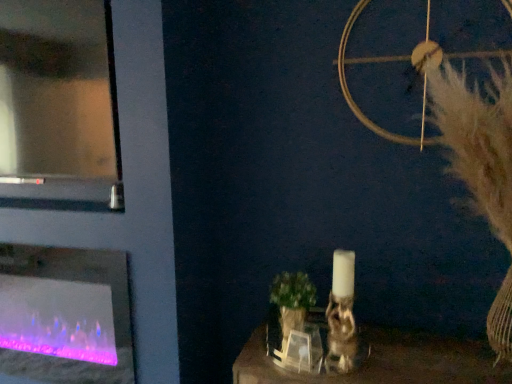
Identify the location of translucent glass fireplace at left. This screenshot has width=512, height=384. pyautogui.click(x=64, y=316).

Consider the image. Which object is closer to the camera, transparent glass door at upper left or translucent glass fireplace at left?

transparent glass door at upper left is in front.

Looking at this image, does transparent glass door at upper left appear on the left side of translucent glass fireplace at left?

Yes, transparent glass door at upper left is to the left of translucent glass fireplace at left.

Is transparent glass door at upper left taller or shorter than translucent glass fireplace at left?

In the image, transparent glass door at upper left appears to be taller than translucent glass fireplace at left.

Which of these two, white fluffy feather at upper right or transparent glass door at upper left, is bigger?

white fluffy feather at upper right is bigger.

Based on their positions, is white fluffy feather at upper right located to the left or right of transparent glass door at upper left?

From the image, it's evident that white fluffy feather at upper right is to the right of transparent glass door at upper left.

Could you tell me if white fluffy feather at upper right is turned towards transparent glass door at upper left?

No, white fluffy feather at upper right is not oriented towards transparent glass door at upper left.

Who is smaller, translucent glass fireplace at left or white fluffy feather at upper right?

Smaller between the two is translucent glass fireplace at left.

Does point (118, 342) lie in front of point (508, 146)?

That is False.

From the image's perspective, would you say translucent glass fireplace at left is positioned over white fluffy feather at upper right?

Incorrect, from the image's perspective, translucent glass fireplace at left is lower than white fluffy feather at upper right.

In the scene shown: From a real-world perspective, is translucent glass fireplace at left above or below white fluffy feather at upper right?

translucent glass fireplace at left is below white fluffy feather at upper right.

Locate an element on the screen. The image size is (512, 384). glass door on the left of white fluffy feather at upper right is located at coordinates (58, 107).

Between transparent glass door at upper left and white fluffy feather at upper right, which one has smaller width?

transparent glass door at upper left.

Is transparent glass door at upper left at the right side of white fluffy feather at upper right?

Incorrect, transparent glass door at upper left is not on the right side of white fluffy feather at upper right.

Could you tell me if transparent glass door at upper left is turned towards white fluffy feather at upper right?

No, transparent glass door at upper left is not facing towards white fluffy feather at upper right.

Considering their positions, is translucent glass fireplace at left located in front of or behind transparent glass door at upper left?

translucent glass fireplace at left is positioned farther from the viewer than transparent glass door at upper left.

From the picture: From a real-world perspective, between translucent glass fireplace at left and transparent glass door at upper left, who is vertically higher?

transparent glass door at upper left is physically above.

Is point (78, 281) farther from camera compared to point (3, 25)?

Yes.

From a real-world perspective, which is physically above, white fluffy feather at upper right or translucent glass fireplace at left?

white fluffy feather at upper right, from a real-world perspective.

Does white fluffy feather at upper right appear on the right side of translucent glass fireplace at left?

Indeed, white fluffy feather at upper right is positioned on the right side of translucent glass fireplace at left.

Considering the positions of objects white fluffy feather at upper right and translucent glass fireplace at left in the image provided, who is in front, white fluffy feather at upper right or translucent glass fireplace at left?

Positioned in front is white fluffy feather at upper right.

Is there a large distance between white fluffy feather at upper right and translucent glass fireplace at left?

Absolutely, white fluffy feather at upper right is distant from translucent glass fireplace at left.

Where is `fireplace that appears behind the transparent glass door at upper left`? Image resolution: width=512 pixels, height=384 pixels. fireplace that appears behind the transparent glass door at upper left is located at coordinates (64, 316).

Where is `fur below the transparent glass door at upper left (from the image's perspective)`? This screenshot has width=512, height=384. fur below the transparent glass door at upper left (from the image's perspective) is located at coordinates (478, 139).

Estimate the real-world distances between objects in this image. Which object is further from transparent glass door at upper left, white fluffy feather at upper right or translucent glass fireplace at left?

Among the two, white fluffy feather at upper right is located further to transparent glass door at upper left.

When comparing their distances from translucent glass fireplace at left, does transparent glass door at upper left or white fluffy feather at upper right seem closer?

The object closer to translucent glass fireplace at left is transparent glass door at upper left.

Based on the photo, which object lies nearer to the anchor point transparent glass door at upper left, translucent glass fireplace at left or white fluffy feather at upper right?

Based on the image, translucent glass fireplace at left appears to be nearer to transparent glass door at upper left.

Which object lies nearer to the anchor point translucent glass fireplace at left, white fluffy feather at upper right or transparent glass door at upper left?

Based on the image, transparent glass door at upper left appears to be nearer to translucent glass fireplace at left.

Looking at the image, which one is located further to white fluffy feather at upper right, transparent glass door at upper left or translucent glass fireplace at left?

translucent glass fireplace at left is further to white fluffy feather at upper right.

Considering their positions, is translucent glass fireplace at left positioned further to white fluffy feather at upper right than transparent glass door at upper left?

Among the two, translucent glass fireplace at left is located further to white fluffy feather at upper right.

I want to click on fireplace between transparent glass door at upper left and white fluffy feather at upper right from left to right, so click(64, 316).